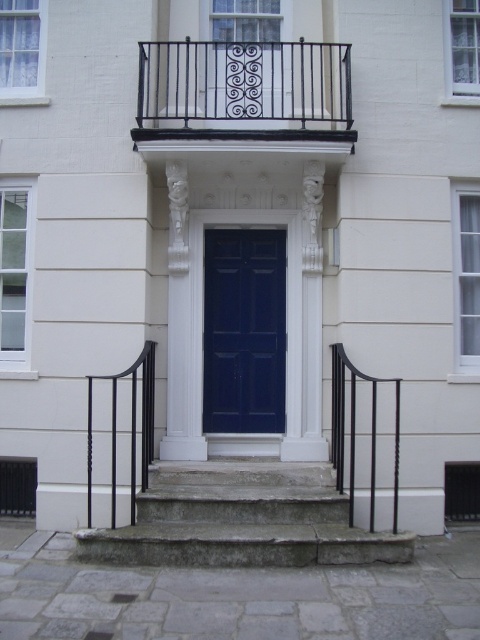
You are standing at the entrance of a classic building. There is a dark blue door framed by white ornate columns with decorative carvings. Above the door is a small balcony with a black wrought iron railing. The balcony is supported by two white corbels with carved faces. The steps leading to the door are light stone with wear, and there are black metal railings on both sides. You need to reach a specific point marked at coordinates point (218,401). Can you estimate how far this point is from your camera

The distance between point (218,401) and the camera is 8.05 meters.